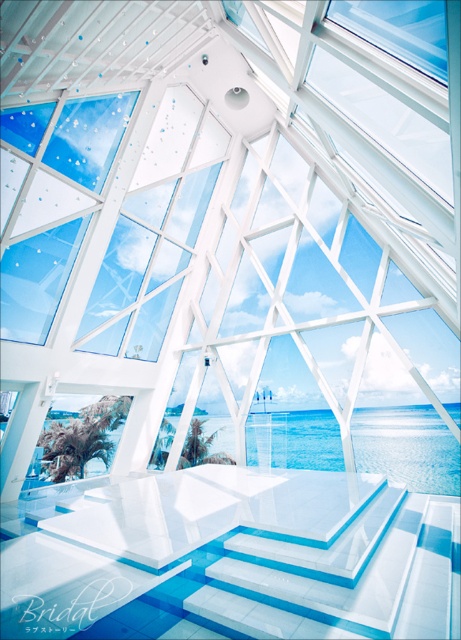
From the picture: You are standing at the base of the white steps in the image and want to reach the platform. There are two points marked on the steps, one at point coordinates point (265, 412) and another at point coordinates point (385, 49). Which point is closer to the platform?

Point (265, 412) is behind point (385, 49), so the closer point to the platform is point (385, 49).

You are an architect designing a new building. You need to install a new light fixture between the transparent glass water at center and the transparent glass window at upper center. Which object should the light fixture be placed closer to if it needs to be closer to the taller object?

The transparent glass water at center is taller than the transparent glass window at upper center, so the light fixture should be placed closer to the transparent glass water at center.